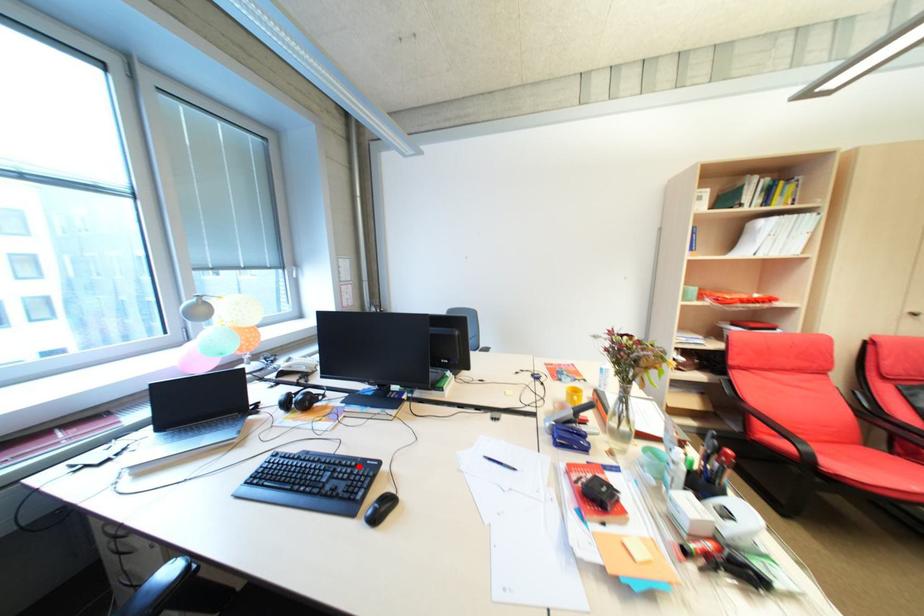
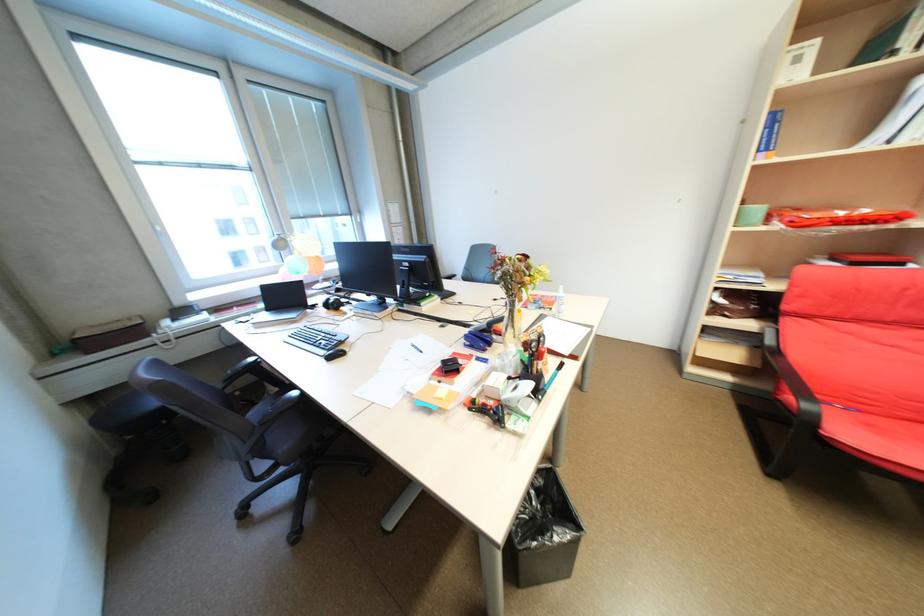
Locate, in the second image, the point that corresponds to the highlighted location in the first image.

(342, 336)